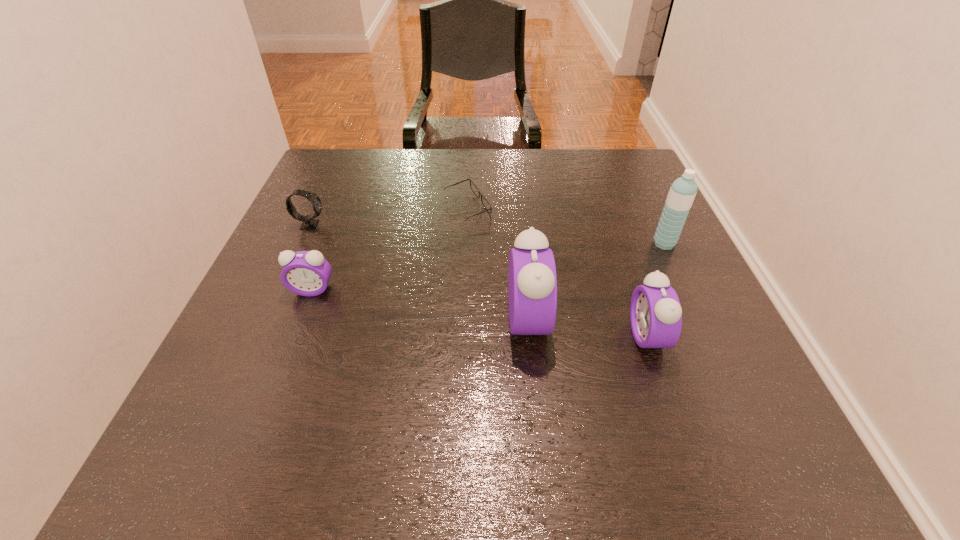
Locate an element on the screen. This screenshot has height=540, width=960. watch at the left edge is located at coordinates (309, 222).

Where is `alarm clock that is at the right edge`? This screenshot has height=540, width=960. alarm clock that is at the right edge is located at coordinates (655, 313).

Image resolution: width=960 pixels, height=540 pixels. What are the coordinates of `water bottle at the right edge` in the screenshot? It's located at (682, 192).

The height and width of the screenshot is (540, 960). What are the coordinates of `vacant space at the far edge of the desktop` in the screenshot? It's located at (484, 166).

Image resolution: width=960 pixels, height=540 pixels. I want to click on vacant space at the left edge of the desktop, so click(282, 270).

Where is `free space at the right edge of the desktop`? The image size is (960, 540). free space at the right edge of the desktop is located at coordinates (639, 284).

Locate an element on the screen. The height and width of the screenshot is (540, 960). vacant space at the far left corner of the desktop is located at coordinates (344, 151).

The image size is (960, 540). In the image, there is a desktop. What are the coordinates of `vacant space at the near left corner` in the screenshot? It's located at (281, 393).

What are the coordinates of `free space at the far right corner` in the screenshot? It's located at (600, 170).

Locate an element on the screen. This screenshot has height=540, width=960. free space at the near right corner of the desktop is located at coordinates (718, 382).